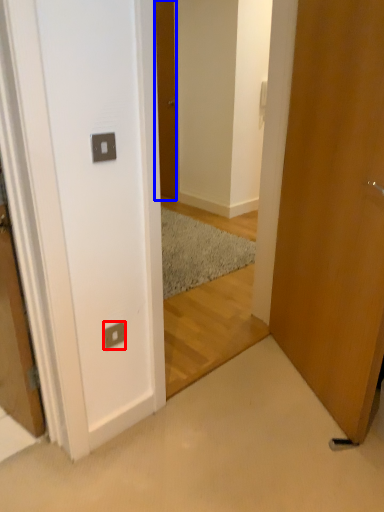
Question: Which object appears farthest to the camera in this image, electric outlet (highlighted by a red box) or door (highlighted by a blue box)?

Choices:
 (A) electric outlet
 (B) door

Answer: (B)